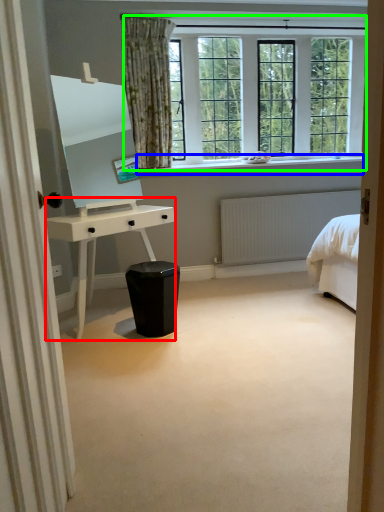
Question: Based on their relative distances, which object is nearer to desk (highlighted by a red box)? Choose from window sill (highlighted by a blue box) and window (highlighted by a green box).

Choices:
 (A) window sill
 (B) window

Answer: (A)